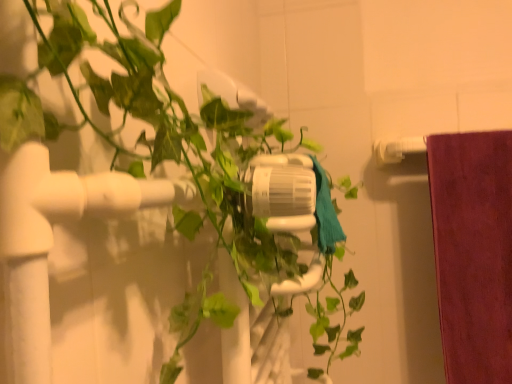
What do you see at coordinates (52, 240) in the screenshot? I see `green matte plant at center` at bounding box center [52, 240].

What is the approximate width of green matte plant at center?

The width of green matte plant at center is 11.14 inches.

The width and height of the screenshot is (512, 384). I want to click on green matte plant at center, so click(x=52, y=240).

Measure the distance between point [122,186] and camera.

Point [122,186] and camera are 9.84 inches apart.

The image size is (512, 384). What do you see at coordinates (325, 212) in the screenshot?
I see `teal fabric towel at center` at bounding box center [325, 212].

In order to face teal fabric towel at center, should I rotate leftwards or rightwards?

Turn right approximately 10.697 degrees to face it.

What are the coordinates of `teal fabric towel at center` in the screenshot? It's located at (325, 212).

The image size is (512, 384). What are the coordinates of `green matte plant at center` in the screenshot? It's located at (52, 240).

Considering the positions of objects green matte plant at center and teal fabric towel at center in the image provided, who is more to the left, green matte plant at center or teal fabric towel at center?

green matte plant at center.

Is green matte plant at center positioned before teal fabric towel at center?

Yes, it is in front of teal fabric towel at center.

Which point is more distant from viewer, (11,200) or (333,238)?

Positioned behind is point (333,238).

From the image's perspective, which one is positioned higher, green matte plant at center or teal fabric towel at center?

From the image's view, teal fabric towel at center is above.

Consider the image. From a real-world perspective, which is physically above, green matte plant at center or teal fabric towel at center?

From a 3D spatial view, teal fabric towel at center is above.

In terms of width, does green matte plant at center look wider or thinner when compared to teal fabric towel at center?

Clearly, green matte plant at center has more width compared to teal fabric towel at center.

Considering the relative sizes of green matte plant at center and teal fabric towel at center in the image provided, is green matte plant at center taller than teal fabric towel at center?

Indeed, green matte plant at center has a greater height compared to teal fabric towel at center.

In the scene shown: In terms of size, does green matte plant at center appear bigger or smaller than teal fabric towel at center?

Considering their sizes, green matte plant at center takes up more space than teal fabric towel at center.

Is green matte plant at center inside or outside of teal fabric towel at center?

green matte plant at center cannot be found inside teal fabric towel at center.

Is green matte plant at center next to teal fabric towel at center and touching it?

No, green matte plant at center is not next to teal fabric towel at center.

Based on the photo, is green matte plant at center oriented towards teal fabric towel at center?

Yes, green matte plant at center is oriented towards teal fabric towel at center.

What's the angular difference between green matte plant at center and teal fabric towel at center's facing directions?

They differ by 0.00113 degrees in their facing directions.

What are the coordinates of `bath towel located behind the green matte plant at center` in the screenshot? It's located at (325, 212).

Can you confirm if teal fabric towel at center is positioned to the left of green matte plant at center?

In fact, teal fabric towel at center is to the right of green matte plant at center.

Does teal fabric towel at center come behind green matte plant at center?

Yes, it is behind green matte plant at center.

Considering the positions of points (342, 231) and (4, 234), is point (342, 231) farther from camera compared to point (4, 234)?

Yes, it is behind point (4, 234).

From the image's perspective, is teal fabric towel at center beneath green matte plant at center?

No.

From a real-world perspective, who is located lower, teal fabric towel at center or green matte plant at center?

green matte plant at center, from a real-world perspective.

Does teal fabric towel at center have a greater width compared to green matte plant at center?

Incorrect, the width of teal fabric towel at center does not surpass that of green matte plant at center.

Which of these two, teal fabric towel at center or green matte plant at center, stands taller?

green matte plant at center.

Is teal fabric towel at center bigger or smaller than green matte plant at center?

Clearly, teal fabric towel at center is smaller in size than green matte plant at center.

Is teal fabric towel at center not inside green matte plant at center?

No, teal fabric towel at center is inside green matte plant at center's boundary.

Is teal fabric towel at center directly adjacent to green matte plant at center?

There is a gap between teal fabric towel at center and green matte plant at center.

Is teal fabric towel at center facing away from green matte plant at center?

Yes.

How different are the orientations of teal fabric towel at center and green matte plant at center in degrees?

0.00113 degrees.

This screenshot has height=384, width=512. In order to click on houseplant directly beneath the teal fabric towel at center (from a real-world perspective) in this screenshot , I will do `click(52, 240)`.

Where is `bath towel on the right of green matte plant at center`? Image resolution: width=512 pixels, height=384 pixels. bath towel on the right of green matte plant at center is located at coordinates (325, 212).

The image size is (512, 384). I want to click on houseplant below the teal fabric towel at center (from a real-world perspective), so click(52, 240).